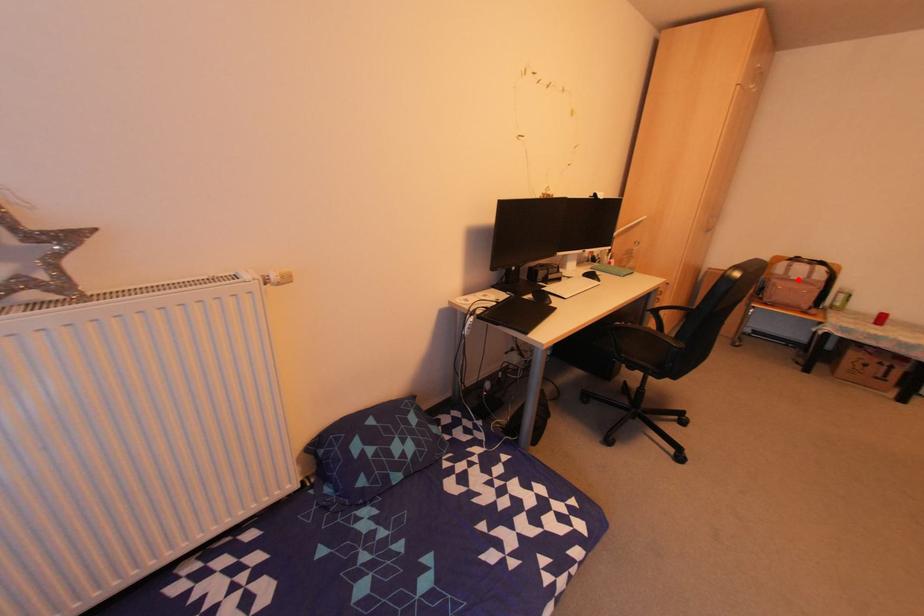
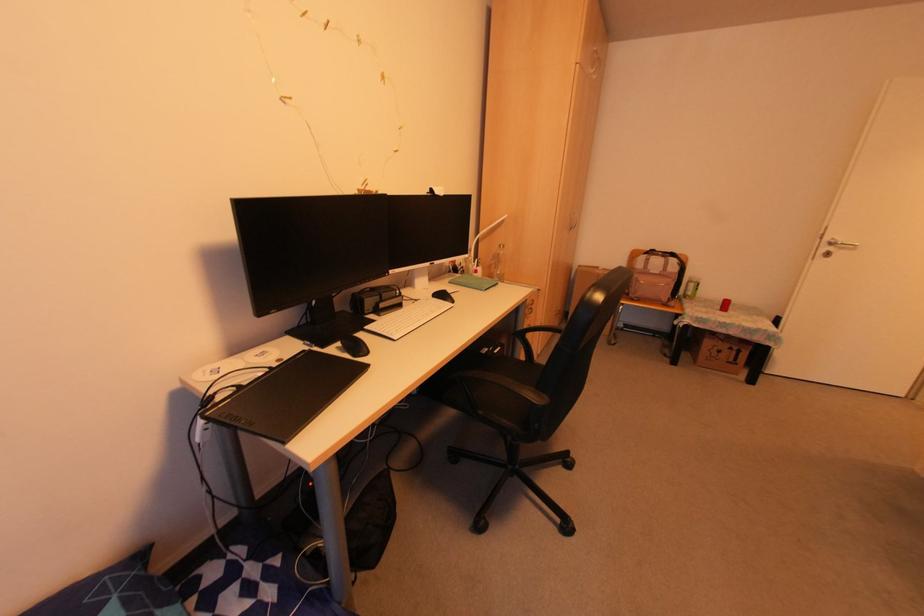
Question: I am providing you with two images of the same scene from different viewpoints. A red point is marked on the first image. Can you still see the location of the red point in image 2?

Choices:
 (A) Yes
 (B) No

Answer: (A)